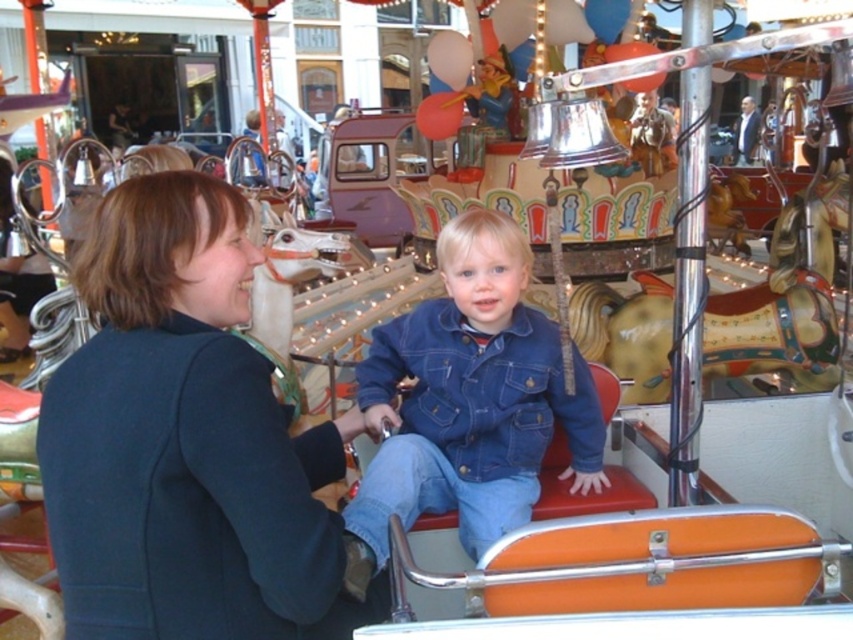
You are a photographer standing at the back of the carousel. You want to take a photo of the dark blue jacket at center and denim jacket at center. Which jacket will appear closer to the top of the photo?

The dark blue jacket at center is located above the denim jacket at center, so it will appear closer to the top of the photo.